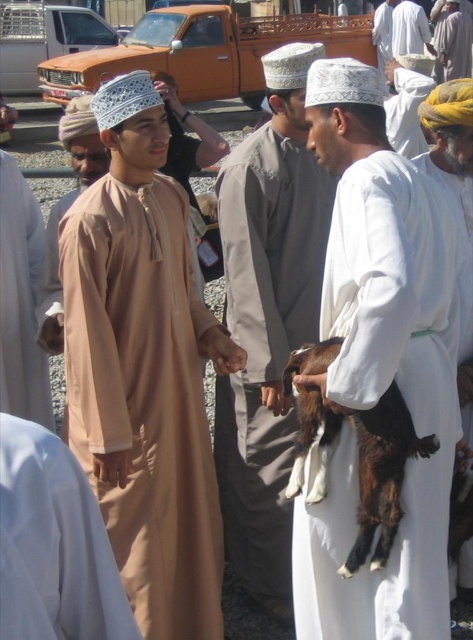
Question: Can you confirm if white woolen turban at right is positioned to the left of white cotton turban at upper right?

Choices:
 (A) no
 (B) yes

Answer: (B)

Question: Is matte beige robe at center bigger than white woolen turban at right?

Choices:
 (A) yes
 (B) no

Answer: (A)

Question: Which of the following is the farthest from the observer?

Choices:
 (A) (220, 216)
 (B) (380, 467)
 (C) (470, 196)
 (D) (8, 492)

Answer: (C)

Question: Considering the relative positions of matte beige robe at center and white cotton robe at center in the image provided, where is matte beige robe at center located with respect to white cotton robe at center?

Choices:
 (A) above
 (B) below

Answer: (B)

Question: Based on their relative distances, which object is farther from the white cotton turban at upper right?

Choices:
 (A) matte beige robe at center
 (B) light brown fabric at center
 (C) white woolen turban at right
 (D) light brown fabric robe at center

Answer: (D)

Question: Which point is closer to the camera?

Choices:
 (A) (220, 404)
 (B) (104, 572)
 (C) (117, 518)
 (D) (425, 566)

Answer: (B)